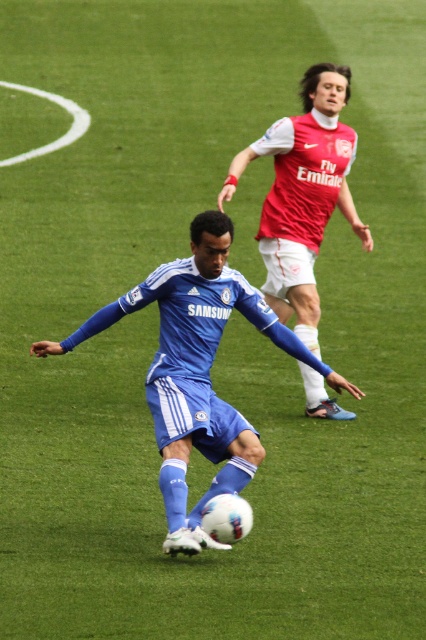
At what (x,y) coordinates should I click in order to perform the action: click on matte blue uniform at center. Please return your answer as a coordinate pair (x, y). The image size is (426, 640). Looking at the image, I should click on (198, 371).

Is matte blue uniform at center above red jersey at upper right?

Actually, matte blue uniform at center is below red jersey at upper right.

Locate an element on the screen. The width and height of the screenshot is (426, 640). matte blue uniform at center is located at coordinates (198, 371).